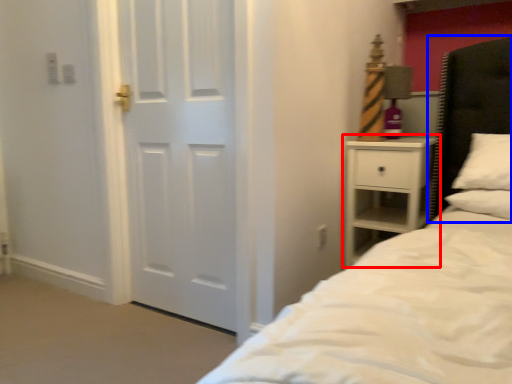
Question: Which object appears closest to the camera in this image, nightstand (highlighted by a red box) or headboard (highlighted by a blue box)?

Choices:
 (A) nightstand
 (B) headboard

Answer: (B)